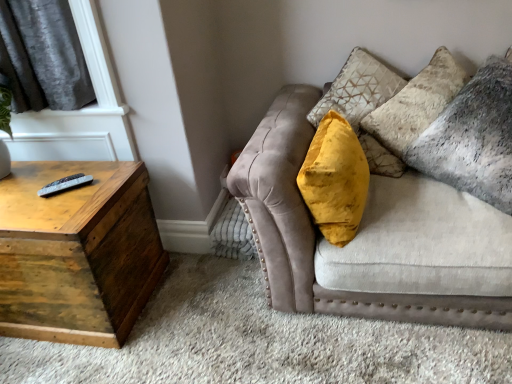
Question: Is black plastic remote at left inside wooden trunk at left?

Choices:
 (A) yes
 (B) no

Answer: (B)

Question: Is the depth of wooden trunk at left greater than that of black plastic remote at left?

Choices:
 (A) no
 (B) yes

Answer: (A)

Question: From a real-world perspective, is wooden trunk at left under black plastic remote at left?

Choices:
 (A) yes
 (B) no

Answer: (A)

Question: From a real-world perspective, is wooden trunk at left on top of black plastic remote at left?

Choices:
 (A) no
 (B) yes

Answer: (A)

Question: Is wooden trunk at left taller than black plastic remote at left?

Choices:
 (A) yes
 (B) no

Answer: (A)

Question: Looking at the image, does velvet beige couch at upper right seem bigger or smaller compared to velvet yellow pillow at center?

Choices:
 (A) big
 (B) small

Answer: (A)

Question: In terms of height, does velvet beige couch at upper right look taller or shorter compared to velvet yellow pillow at center?

Choices:
 (A) short
 (B) tall

Answer: (B)

Question: From the image's perspective, is velvet beige couch at upper right positioned above or below velvet yellow pillow at center?

Choices:
 (A) above
 (B) below

Answer: (B)

Question: Based on their positions, is velvet beige couch at upper right located to the left or right of velvet yellow pillow at center?

Choices:
 (A) right
 (B) left

Answer: (A)

Question: Would you say velvet beige couch at upper right is inside or outside black plastic remote at left?

Choices:
 (A) inside
 (B) outside

Answer: (B)

Question: Is velvet beige couch at upper right to the left or to the right of black plastic remote at left in the image?

Choices:
 (A) right
 (B) left

Answer: (A)

Question: Considering the positions of velvet beige couch at upper right and black plastic remote at left in the image, is velvet beige couch at upper right wider or thinner than black plastic remote at left?

Choices:
 (A) wide
 (B) thin

Answer: (A)

Question: From their relative heights in the image, would you say velvet beige couch at upper right is taller or shorter than black plastic remote at left?

Choices:
 (A) short
 (B) tall

Answer: (B)

Question: In the image, is velvet gray pillow at upper right positioned in front of or behind wooden trunk at left?

Choices:
 (A) behind
 (B) front

Answer: (B)

Question: Does point (459, 153) appear closer or farther from the camera than point (65, 284)?

Choices:
 (A) closer
 (B) farther

Answer: (B)